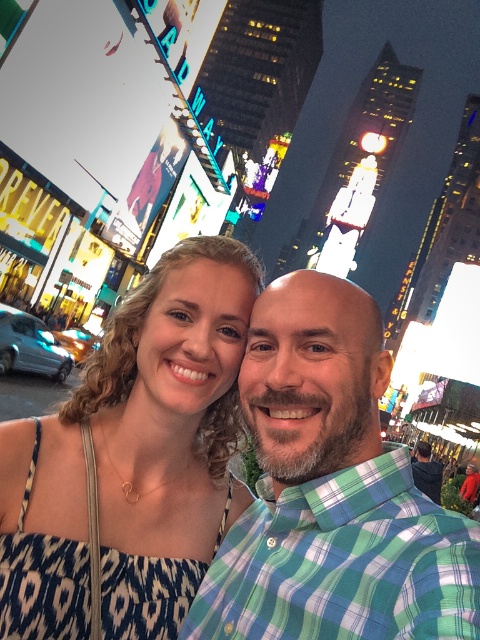
Question: Is blue printed dress at center positioned at the back of green plaid shirt at center?

Choices:
 (A) yes
 (B) no

Answer: (A)

Question: Is blue printed dress at center below green plaid shirt at center?

Choices:
 (A) yes
 (B) no

Answer: (B)

Question: Among these points, which one is farthest from the camera?

Choices:
 (A) (309, 433)
 (B) (180, 538)

Answer: (B)

Question: Which of the following is the farthest from the observer?

Choices:
 (A) green plaid shirt at center
 (B) blue printed dress at center

Answer: (B)

Question: Is blue printed dress at center in front of green plaid shirt at center?

Choices:
 (A) yes
 (B) no

Answer: (B)